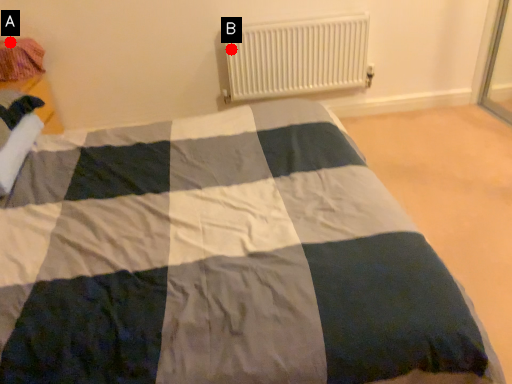
Question: Two points are circled on the image, labeled by A and B beside each circle. Which point appears closest to the camera in this image?

Choices:
 (A) A is closer
 (B) B is closer

Answer: (A)